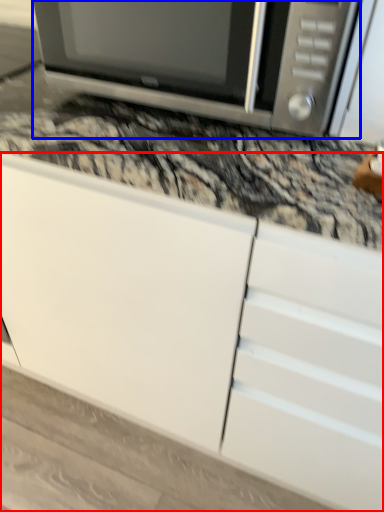
Question: Which of the following is the closest to the observer, cabinetry (highlighted by a red box) or microwave oven (highlighted by a blue box)?

Choices:
 (A) cabinetry
 (B) microwave oven

Answer: (A)